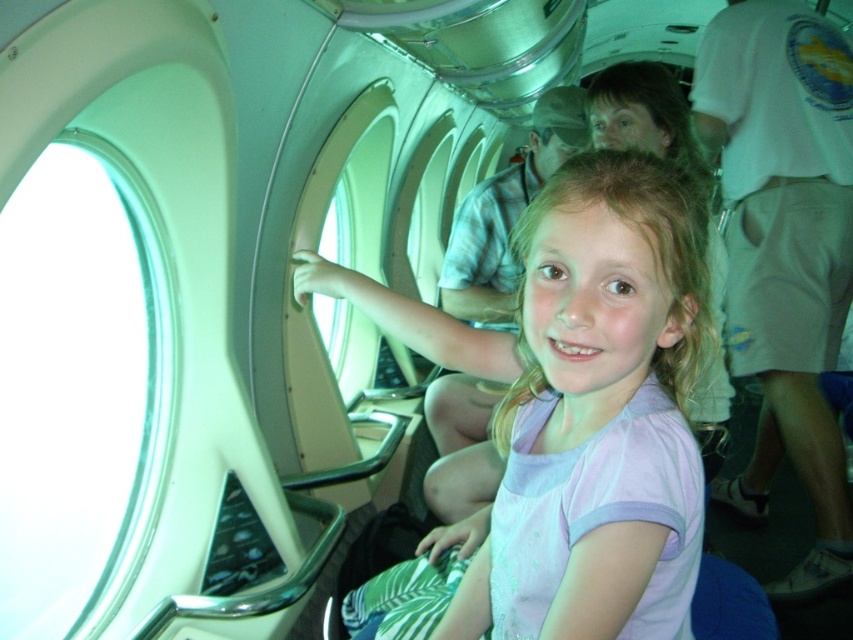
Question: Among these points, which one is farthest from the camera?

Choices:
 (A) (395, 612)
 (B) (3, 513)

Answer: (B)

Question: In this image, where is transparent glass airplane window at left located relative to pink fabric shirt at center?

Choices:
 (A) right
 (B) left

Answer: (B)

Question: Which of the following is the farthest from the observer?

Choices:
 (A) pink fabric shirt at center
 (B) transparent glass airplane window at left

Answer: (B)

Question: Considering the relative positions of transparent glass airplane window at left and pink fabric shirt at center in the image provided, where is transparent glass airplane window at left located with respect to pink fabric shirt at center?

Choices:
 (A) left
 (B) right

Answer: (A)

Question: Can you confirm if transparent glass airplane window at left is positioned to the right of pink fabric shirt at center?

Choices:
 (A) yes
 (B) no

Answer: (B)